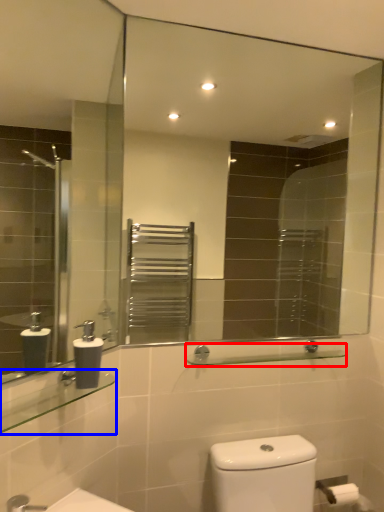
Question: Which object is further to the camera taking this photo, balustrade (highlighted by a red box) or balustrade (highlighted by a blue box)?

Choices:
 (A) balustrade
 (B) balustrade

Answer: (A)